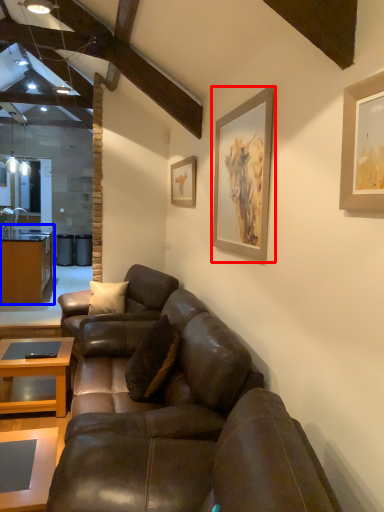
Question: Which object appears farthest to the camera in this image, picture frame (highlighted by a red box) or cabinetry (highlighted by a blue box)?

Choices:
 (A) picture frame
 (B) cabinetry

Answer: (B)